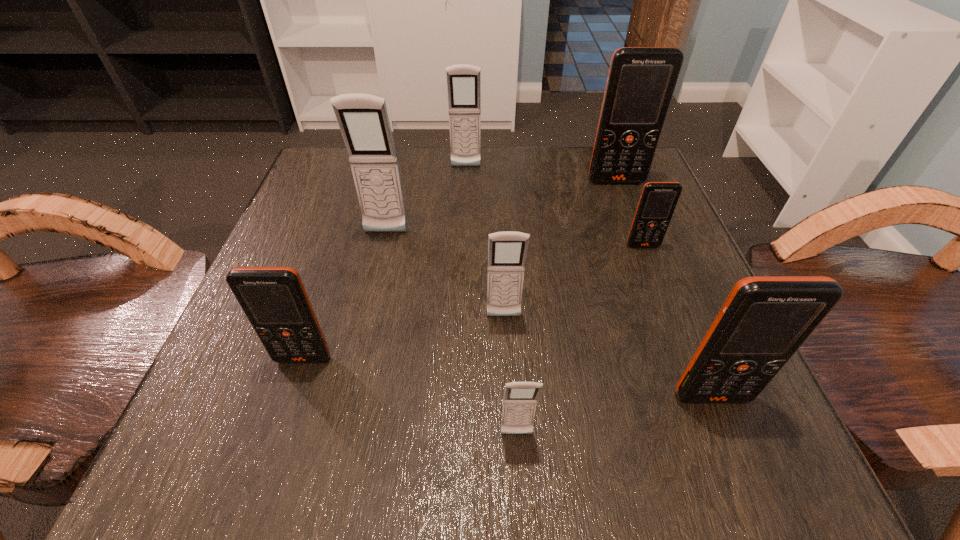
Find the location of a particular element. This screenshot has width=960, height=540. the second smallest orange cellular telephone is located at coordinates (274, 300).

Identify the location of the sixth farthest cellular telephone. Image resolution: width=960 pixels, height=540 pixels. 274,300.

Find the location of `the smallest orange cellular telephone`. the smallest orange cellular telephone is located at coordinates (658, 200).

The height and width of the screenshot is (540, 960). Identify the location of the fourth farthest cellular telephone. (658, 200).

This screenshot has height=540, width=960. I want to click on the nearest cellular telephone, so click(520, 398).

At what (x,y) coordinates should I click in order to perform the action: click on the nearest gray cellular telephone. Please return your answer as a coordinate pair (x, y). Looking at the image, I should click on (520, 398).

You are a GUI agent. You are given a task and a screenshot of the screen. Output one action in this format:
    pyautogui.click(x=<x>, y=<y>)
    Task: Click on the free space located 0.330m on the screen of the biggest orange cellular telephone
    
    Given the screenshot: What is the action you would take?
    pyautogui.click(x=663, y=306)

This screenshot has width=960, height=540. In order to click on vacant region located on the front-facing side of the biggest gray cellular telephone in this screenshot , I will do click(x=358, y=354).

Identify the location of vacant region located 0.200m on the front-facing side of the farthest cellular telephone. The image size is (960, 540). (464, 229).

Where is `blank space located on the screen of the seventh farthest cellular telephone`? blank space located on the screen of the seventh farthest cellular telephone is located at coordinates coord(733,451).